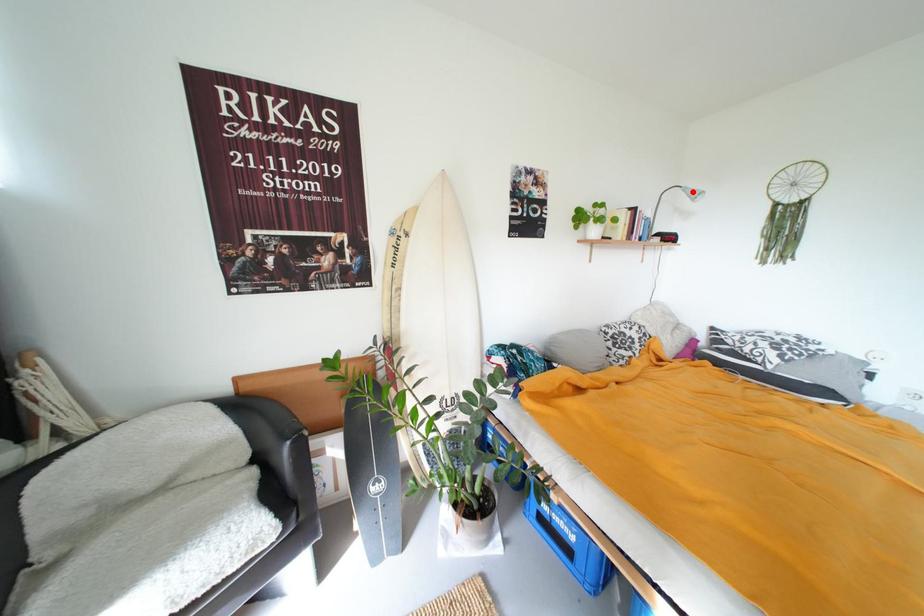
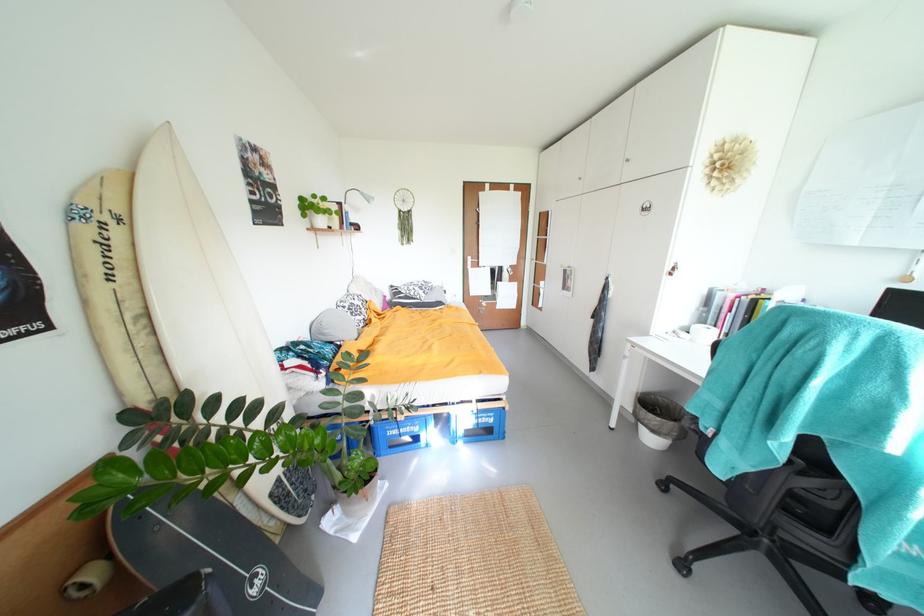
In the second image, find the point that corresponds to the highlighted location in the first image.

(370, 196)